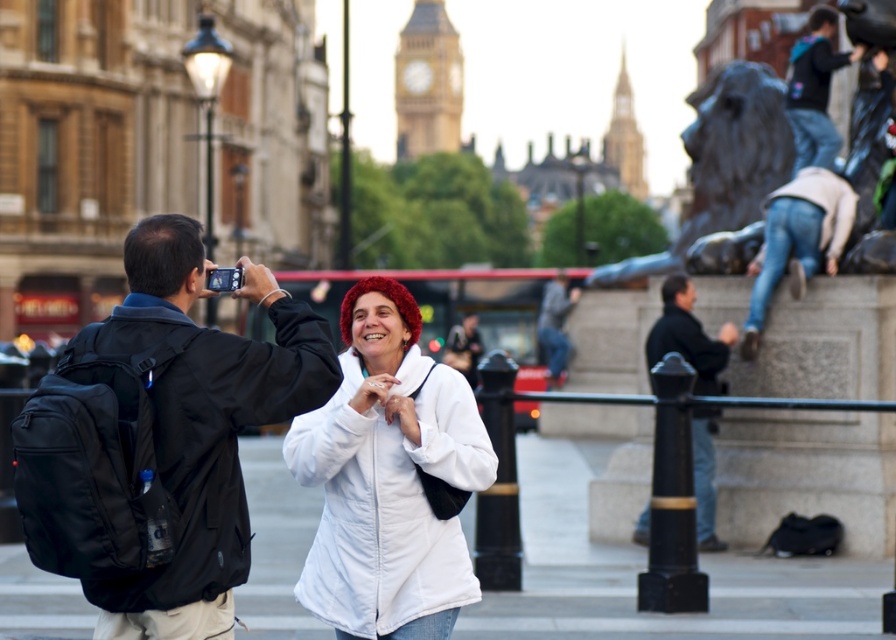
Does white fleece jacket at center have a smaller size compared to dark gray jacket at center?

No.

Does point (378, 483) lie behind point (550, 339)?

No, it is in front of (550, 339).

Find the location of a particular element. Image resolution: width=896 pixels, height=640 pixels. white fleece jacket at center is located at coordinates (386, 477).

Which is below, black fabric jacket at left or golden stone clock tower at upper center?

black fabric jacket at left

Which is in front, point (234, 488) or point (426, 10)?

Point (234, 488)

This screenshot has height=640, width=896. I want to click on black fabric jacket at left, so click(x=218, y=456).

Does golden stone clock tower at upper center have a smaller size compared to dark gray jacket at center?

No.

Is golden stone clock tower at upper center positioned before dark gray jacket at center?

No, golden stone clock tower at upper center is further to the viewer.

Does point (455, 38) lie in front of point (564, 356)?

No, it is not.

Image resolution: width=896 pixels, height=640 pixels. I want to click on golden stone clock tower at upper center, so [x=427, y=83].